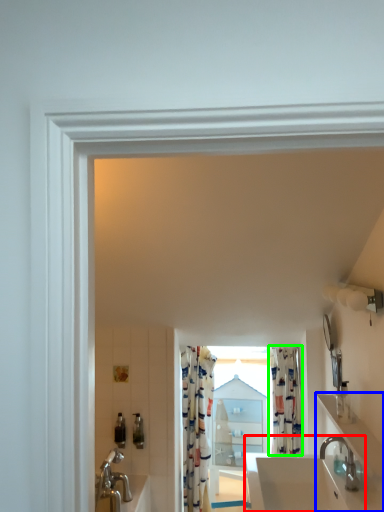
Question: Which is farther away from sink (highlighted by a red box)? counter top (highlighted by a blue box) or shower curtain (highlighted by a green box)?

Choices:
 (A) counter top
 (B) shower curtain

Answer: (B)